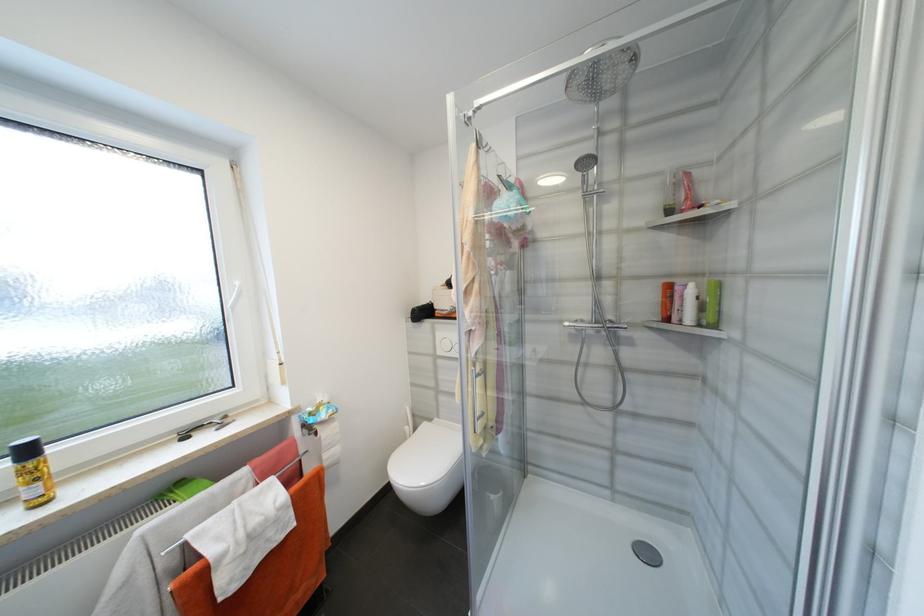
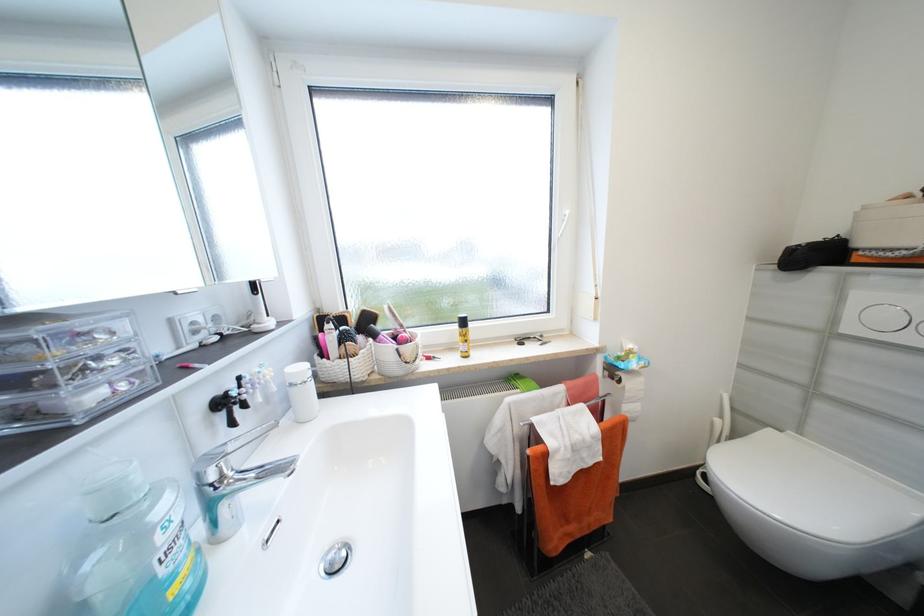
Question: How did the camera likely rotate?

Choices:
 (A) Left
 (B) Right
 (C) Up
 (D) Down

Answer: (A)